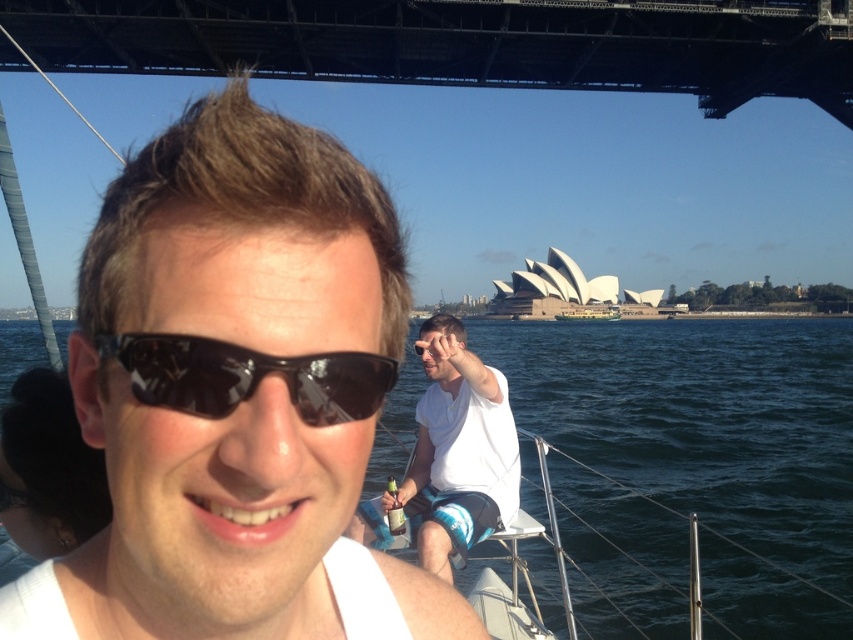
Question: Which point appears closest to the camera in this image?

Choices:
 (A) (346, 417)
 (B) (660, 595)
 (C) (416, 536)

Answer: (A)

Question: Which object is farther from the camera taking this photo?

Choices:
 (A) black reflective sunglasses at center
 (B) white cotton shirt at center
 (C) dark blue water at center
 (D) matte black sunglasses at center

Answer: (B)

Question: Considering the relative positions of dark blue water at center and white cotton shirt at center in the image provided, where is dark blue water at center located with respect to white cotton shirt at center?

Choices:
 (A) right
 (B) left

Answer: (B)

Question: Observing the image, what is the correct spatial positioning of matte black sunglasses at center in reference to dark blue water at center?

Choices:
 (A) right
 (B) left

Answer: (A)

Question: Which object is positioned closest to the matte black sunglasses at center?

Choices:
 (A) dark blue water at center
 (B) black reflective sunglasses at center
 (C) white cotton shirt at center

Answer: (B)

Question: Is matte black sunglasses at center to the left of black reflective sunglasses at center from the viewer's perspective?

Choices:
 (A) no
 (B) yes

Answer: (B)